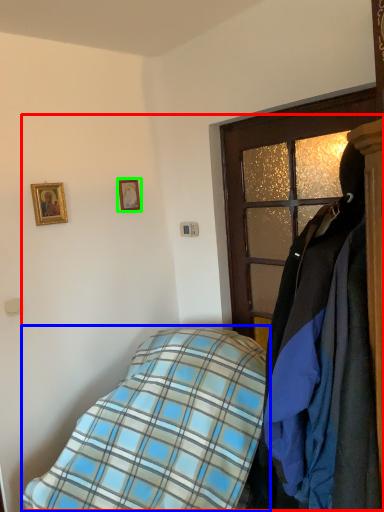
Question: Which object is the farthest from bed (highlighted by a red box)? Choose among these: bed (highlighted by a blue box) or picture frame (highlighted by a green box).

Choices:
 (A) bed
 (B) picture frame

Answer: (B)